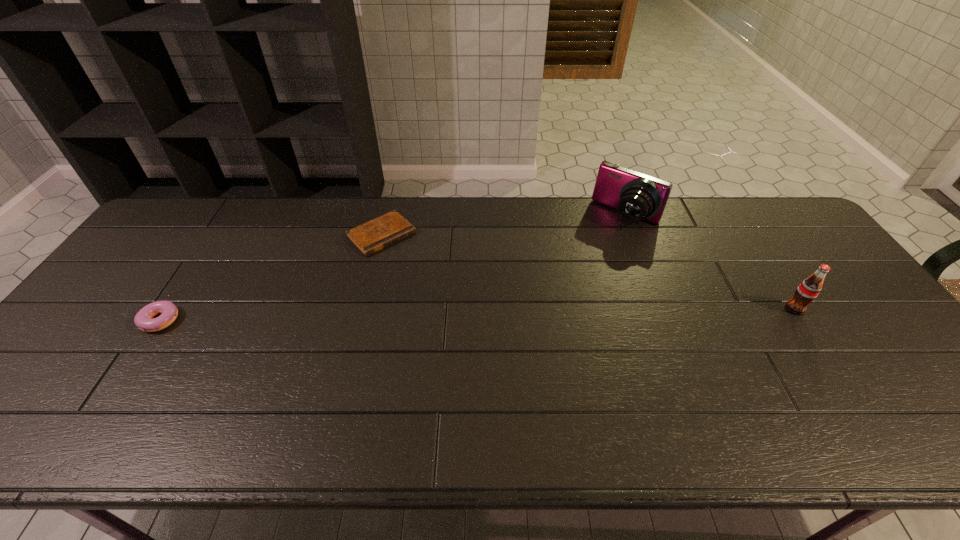
The width and height of the screenshot is (960, 540). Identify the location of free space that is in between the second object from left to right and the camera. (504, 226).

Image resolution: width=960 pixels, height=540 pixels. Find the location of `vacant region between the second object from right to left and the soda`. vacant region between the second object from right to left and the soda is located at coordinates (710, 262).

This screenshot has height=540, width=960. I want to click on free space between the second shortest object and the camera, so click(x=395, y=266).

The image size is (960, 540). Identify the location of vacant point located between the third object from left to right and the leftmost object. [x=395, y=266].

Where is `object that stands as the closest to the second object from left to right`? The height and width of the screenshot is (540, 960). object that stands as the closest to the second object from left to right is located at coordinates (143, 320).

Identify which object is the second closest to the third tallest object. Please provide its 2D coordinates. Your answer should be formatted as a tuple, i.e. [(x, y)], where the tuple contains the x and y coordinates of a point satisfying the conditions above.

[(637, 196)]

What are the coordinates of `free space that satisfies the following two spatial constraints: 1. on the back side of the camera; 2. on the right side of the shortest object` in the screenshot? It's located at (387, 216).